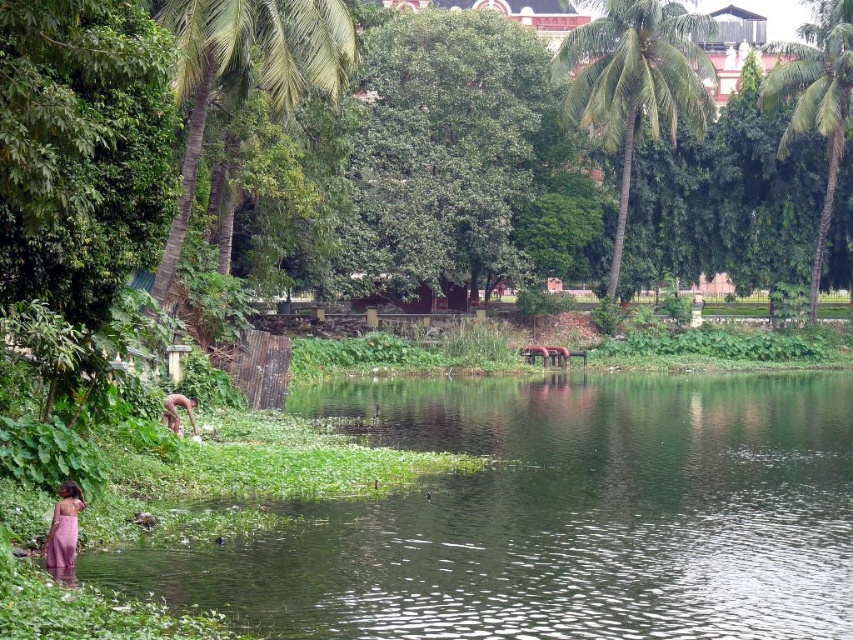
Question: Based on their relative distances, which object is farther from the brown fabric person at lower left?

Choices:
 (A) green leafy palm tree at upper left
 (B) green leafy palm tree at upper center
 (C) green leafy palm tree at upper right
 (D) pink fabric dress at lower left

Answer: (C)

Question: Where is green leafy palm tree at upper right located in relation to brown fabric person at lower left in the image?

Choices:
 (A) right
 (B) left

Answer: (A)

Question: Considering the real-world distances, which object is closest to the brown fabric person at lower left?

Choices:
 (A) pink fabric dress at lower left
 (B) green leafy palm tree at upper right

Answer: (A)

Question: Does green leafy palm tree at upper left have a smaller size compared to green leafy palm tree at upper center?

Choices:
 (A) no
 (B) yes

Answer: (B)

Question: Which point appears closest to the camera in this image?

Choices:
 (A) (752, 616)
 (B) (621, 1)

Answer: (A)

Question: Can you confirm if pink fabric dress at lower left is bigger than brown fabric person at lower left?

Choices:
 (A) no
 (B) yes

Answer: (B)